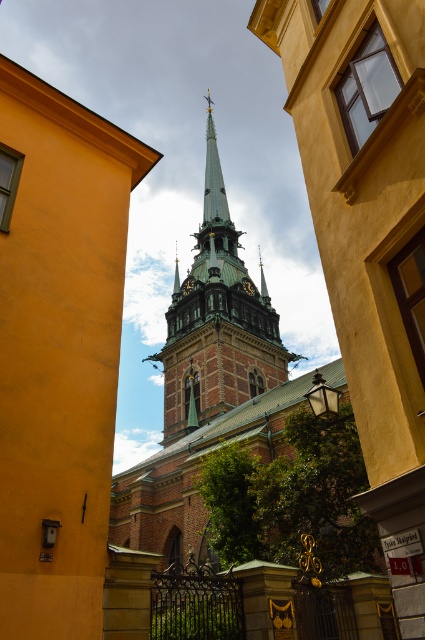
You are standing in front of a historic church and notice two prominent features. The brown stone tower at center and the gold metallic clock at center. Which one is positioned to the left when viewed from your perspective?

The brown stone tower at center is positioned to the left of the gold metallic clock at center.

You are an architect analyzing the church steeple. You notice two spires described as green metallic spire at center and green copper spire at center. Which one is taller?

The green metallic spire at center is taller than the green copper spire at center according to the description provided.